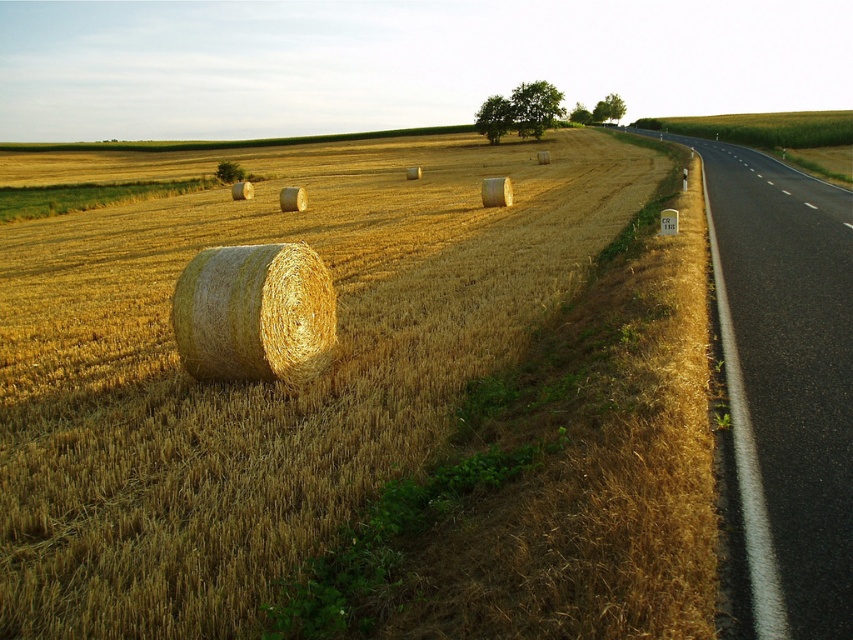
Does golden straw bale at center-left appear on the left side of asphalt road at right?

Indeed, golden straw bale at center-left is positioned on the left side of asphalt road at right.

Is golden straw bale at center-left below asphalt road at right?

No, golden straw bale at center-left is not below asphalt road at right.

Measure the distance between golden straw bale at center-left and camera.

They are 3.84 meters apart.

Find the location of a particular element. This screenshot has height=640, width=853. golden straw bale at center-left is located at coordinates (260, 381).

The height and width of the screenshot is (640, 853). What do you see at coordinates (260, 381) in the screenshot?
I see `golden straw bale at center-left` at bounding box center [260, 381].

Between point (190, 592) and point (242, 276), which one is positioned behind?

The point (242, 276) is behind.

Which is behind, point (495, 292) or point (224, 288)?

The point (495, 292) is more distant.

Find the location of a particular element. This screenshot has height=640, width=853. golden straw bale at center-left is located at coordinates (260, 381).

Can you confirm if asphalt road at right is thinner than golden straw bale at center?

Incorrect, asphalt road at right's width is not less than golden straw bale at center's.

Does point (796, 260) come behind point (198, 266)?

That is True.

Identify the location of asphalt road at right. Image resolution: width=853 pixels, height=640 pixels. (786, 380).